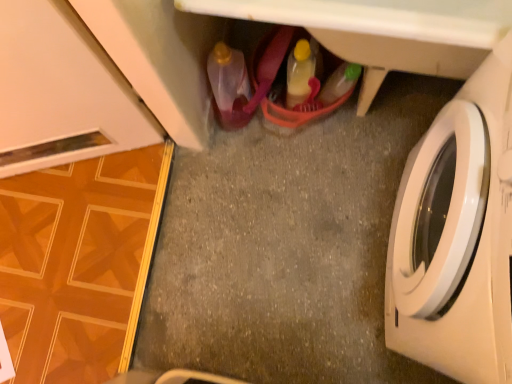
Question: Is the position of translucent plastic bottle at lower center, arranged as the 2th bottle when viewed from the right, more distant than that of white plastic cabinet at center?

Choices:
 (A) no
 (B) yes

Answer: (B)

Question: Is translucent plastic bottle at lower center, which is the 1th bottle in left-to-right order, shorter than white plastic cabinet at center?

Choices:
 (A) yes
 (B) no

Answer: (A)

Question: From a real-world perspective, is translucent plastic bottle at lower center, which is the 1th bottle in left-to-right order, on top of white plastic cabinet at center?

Choices:
 (A) no
 (B) yes

Answer: (A)

Question: Is translucent plastic bottle at lower center, which is the 1th bottle in left-to-right order, outside white plastic cabinet at center?

Choices:
 (A) no
 (B) yes

Answer: (A)

Question: Is translucent plastic bottle at lower center, arranged as the 2th bottle when viewed from the right, facing towards white plastic cabinet at center?

Choices:
 (A) yes
 (B) no

Answer: (A)

Question: Does point (221, 94) appear closer or farther from the camera than point (175, 155)?

Choices:
 (A) closer
 (B) farther

Answer: (A)

Question: From a real-world perspective, relative to smooth gray concrete at center, is translucent plastic bottle at lower center, which is the 1th bottle in left-to-right order, vertically above or below?

Choices:
 (A) below
 (B) above

Answer: (B)

Question: Based on their positions, is translucent plastic bottle at lower center, which is the 1th bottle in left-to-right order, located to the left or right of smooth gray concrete at center?

Choices:
 (A) left
 (B) right

Answer: (A)

Question: Looking at their shapes, would you say translucent plastic bottle at lower center, arranged as the 2th bottle when viewed from the right, is wider or thinner than smooth gray concrete at center?

Choices:
 (A) thin
 (B) wide

Answer: (A)

Question: Is white plastic cabinet at center inside or outside of smooth gray concrete at center?

Choices:
 (A) inside
 (B) outside

Answer: (B)

Question: Is white plastic cabinet at center wider or thinner than smooth gray concrete at center?

Choices:
 (A) thin
 (B) wide

Answer: (A)

Question: Visually, is white plastic cabinet at center positioned to the left or to the right of smooth gray concrete at center?

Choices:
 (A) right
 (B) left

Answer: (A)

Question: In terms of height, does white plastic cabinet at center look taller or shorter compared to smooth gray concrete at center?

Choices:
 (A) tall
 (B) short

Answer: (A)

Question: In the image, is white glossy washing machine at right on the left side or the right side of translucent plastic bottle at lower center, arranged as the 2th bottle when viewed from the right?

Choices:
 (A) left
 (B) right

Answer: (B)

Question: In terms of size, does white glossy washing machine at right appear bigger or smaller than translucent plastic bottle at lower center, which is the 1th bottle in left-to-right order?

Choices:
 (A) small
 (B) big

Answer: (B)